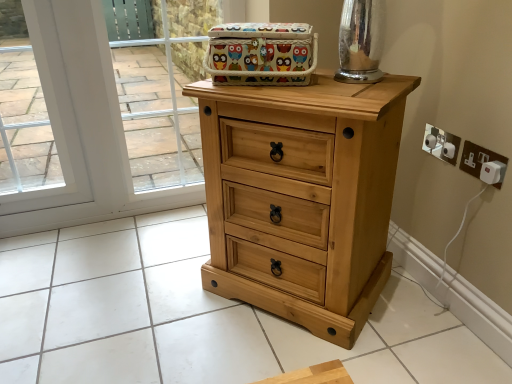
Question: Is white plastic electric outlet at right, the 2th electric outlet viewed from the front, smaller than brushed metal knob at center, the 2th knob in the back-to-front sequence?

Choices:
 (A) no
 (B) yes

Answer: (A)

Question: Is white plastic electric outlet at right, positioned as the first electric outlet in back-to-front order, oriented away from brushed metal knob at center, the 2th knob in the back-to-front sequence?

Choices:
 (A) yes
 (B) no

Answer: (A)

Question: From a real-world perspective, is white plastic electric outlet at right, positioned as the first electric outlet in back-to-front order, physically below brushed metal knob at center, which ranks as the first knob in front-to-back order?

Choices:
 (A) yes
 (B) no

Answer: (B)

Question: Is white plastic electric outlet at right, the 2th electric outlet viewed from the front, far away from brushed metal knob at center, which ranks as the first knob in front-to-back order?

Choices:
 (A) no
 (B) yes

Answer: (A)

Question: Is white plastic electric outlet at right, the 2th electric outlet viewed from the front, thinner than brushed metal knob at center, which ranks as the first knob in front-to-back order?

Choices:
 (A) yes
 (B) no

Answer: (A)

Question: Is brushed metal knob at upper right, which appears as the first knob when viewed from the back, inside the boundaries of white plastic electric outlet at right, positioned as the first electric outlet in back-to-front order, or outside?

Choices:
 (A) outside
 (B) inside

Answer: (B)

Question: Is brushed metal knob at upper right, which appears as the first knob when viewed from the back, wider or thinner than white plastic electric outlet at right, positioned as the first electric outlet in back-to-front order?

Choices:
 (A) wide
 (B) thin

Answer: (A)

Question: Considering the positions of point (434, 145) and point (458, 142), is point (434, 145) closer or farther from the camera than point (458, 142)?

Choices:
 (A) farther
 (B) closer

Answer: (A)

Question: Is brushed metal knob at upper right, which appears as the first knob when viewed from the back, to the left or to the right of white plastic electric outlet at right, the 2th electric outlet viewed from the front, in the image?

Choices:
 (A) right
 (B) left

Answer: (B)

Question: Choose the correct answer: Is white plastic electric outlet at right, the 2th electric outlet viewed from the front, inside transparent glass door at upper left or outside it?

Choices:
 (A) outside
 (B) inside

Answer: (A)

Question: Is white plastic electric outlet at right, the 2th electric outlet viewed from the front, in front of or behind transparent glass door at upper left in the image?

Choices:
 (A) front
 (B) behind

Answer: (A)

Question: In terms of width, does white plastic electric outlet at right, the 2th electric outlet viewed from the front, look wider or thinner when compared to transparent glass door at upper left?

Choices:
 (A) thin
 (B) wide

Answer: (A)

Question: From the image's perspective, relative to transparent glass door at upper left, is white plastic electric outlet at right, positioned as the first electric outlet in back-to-front order, above or below?

Choices:
 (A) above
 (B) below

Answer: (B)

Question: Based on their sizes in the image, would you say brushed metal knob at center, which ranks as the first knob in front-to-back order, is bigger or smaller than white plastic electrical outlet at right, positioned as the first electric outlet in front-to-back order?

Choices:
 (A) small
 (B) big

Answer: (A)

Question: Do you think brushed metal knob at center, which ranks as the first knob in front-to-back order, is within white plastic electrical outlet at right, which is counted as the second electric outlet, starting from the back, or outside of it?

Choices:
 (A) outside
 (B) inside

Answer: (A)